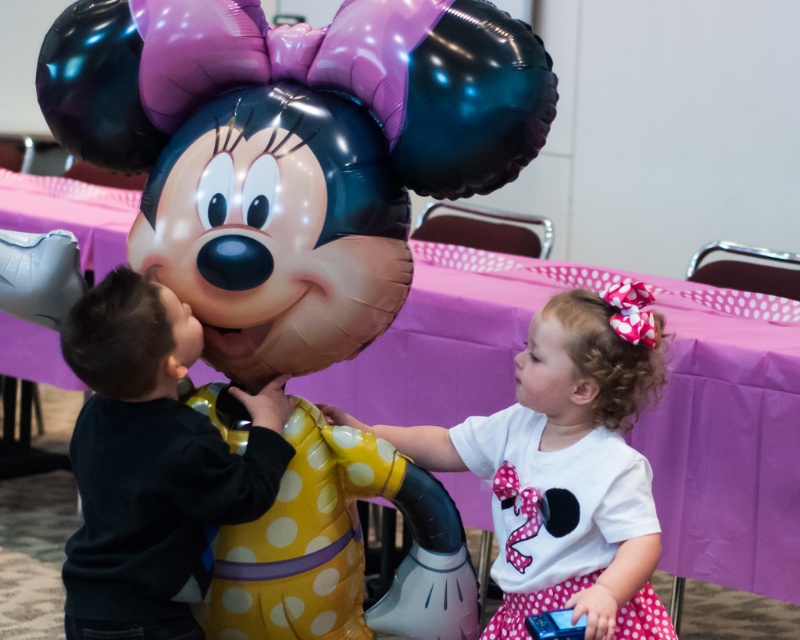
You are a photographer at the party and want to capture a closeup shot of the glossy metallic balloon at upper center without the white matte shirt at center appearing in the frame. Is this possible given their sizes?

The glossy metallic balloon at upper center is wider than the white matte shirt at center, so adjusting the camera angle to focus solely on the balloon might be feasible as the shirt is narrower and could be positioned out of the frame if aligned correctly.

You are a photographer at the birthday party and want to capture a photo where both the glossy metallic balloon at upper center and the black matte shirt at left are visible. Based on their positions, can you tell which object is higher in the frame?

The glossy metallic balloon at upper center is above the black matte shirt at left, so it is higher in the frame.

Based on the photo, you are a photographer at the birthday party and want to take a photo of both the black matte shirt at left and the white matte shirt at center so that both shirts are fully visible. Which shirt should you focus on to ensure the other is in frame?

The black matte shirt at left is shorter than the white matte shirt at center. To ensure both shirts are fully visible, focus on the white matte shirt at center since it is taller, allowing the shorter black matte shirt at left to remain in frame.